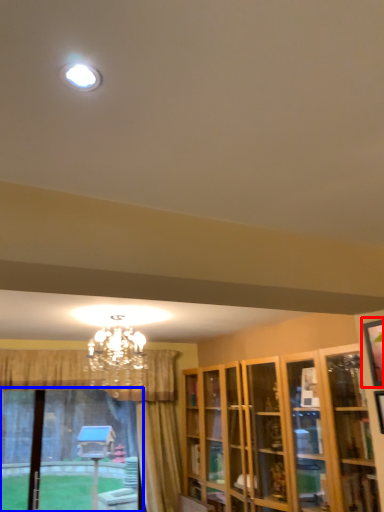
Question: Among these objects, which one is nearest to the camera, picture frame (highlighted by a red box) or bay window (highlighted by a blue box)?

Choices:
 (A) picture frame
 (B) bay window

Answer: (A)